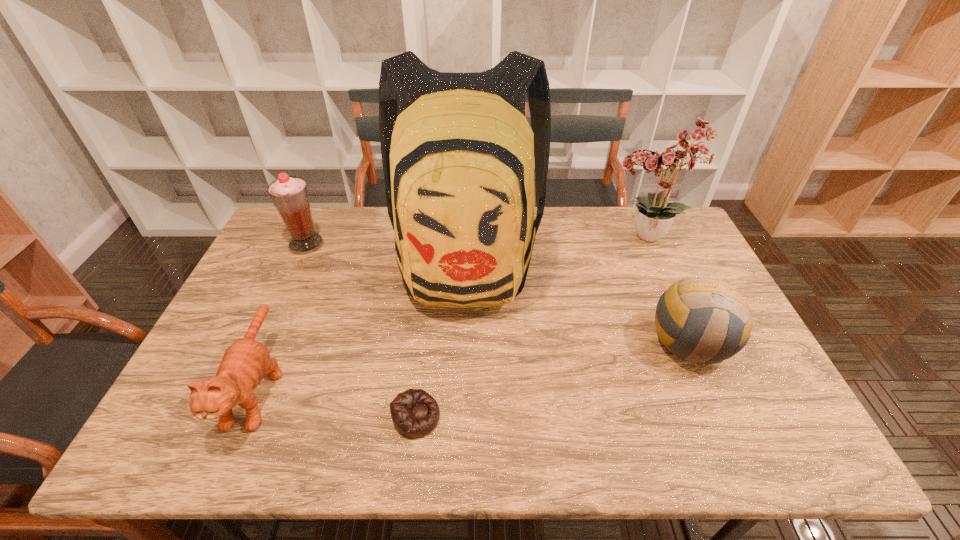
Find the location of a particular element. The image size is (960, 540). flower arrangement that is at the right edge is located at coordinates (654, 215).

The height and width of the screenshot is (540, 960). In order to click on volleyball that is at the right edge in this screenshot , I will do click(x=702, y=320).

The image size is (960, 540). Identify the location of object that is positioned at the far left corner. (289, 194).

At what (x,y) coordinates should I click in order to perform the action: click on object present at the near left corner. Please return your answer as a coordinate pair (x, y). This screenshot has height=540, width=960. Looking at the image, I should click on (245, 361).

Identify the location of object present at the far right corner. Image resolution: width=960 pixels, height=540 pixels. (654, 215).

At what (x,y) coordinates should I click in order to perform the action: click on free region at the far edge of the desktop. Please return your answer as a coordinate pair (x, y). Looking at the image, I should click on (360, 227).

Locate an element on the screen. vacant space at the near edge of the desktop is located at coordinates (375, 421).

Identify the location of free space at the left edge. tap(301, 265).

Locate an element on the screen. blank area at the right edge is located at coordinates (754, 420).

In order to click on free location at the far left corner in this screenshot , I will do `click(285, 230)`.